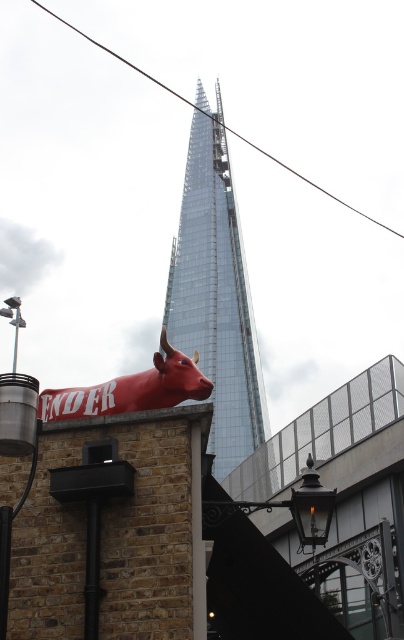
Who is more forward, (174, 342) or (145, 408)?

Point (145, 408)

I want to click on transparent glass skyscraper at center, so click(216, 291).